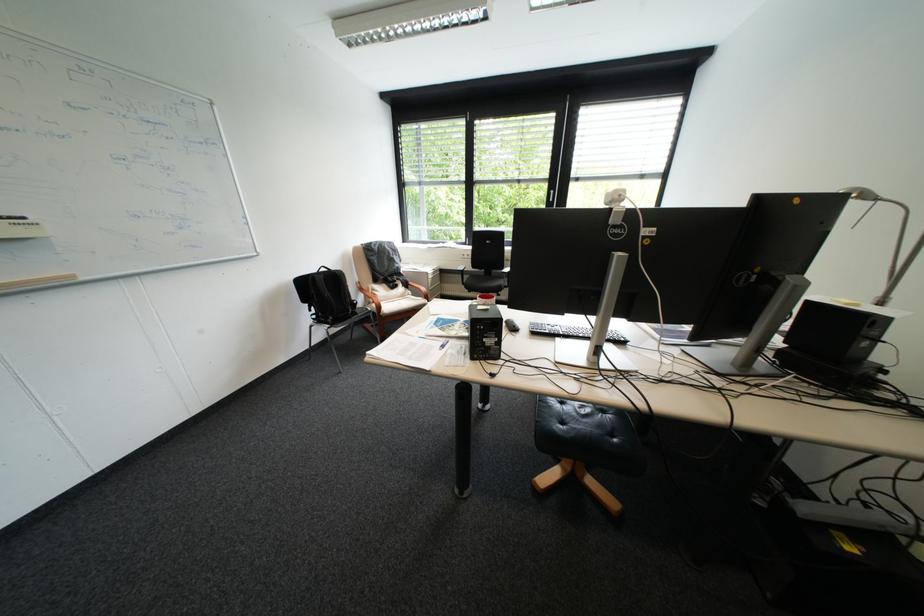
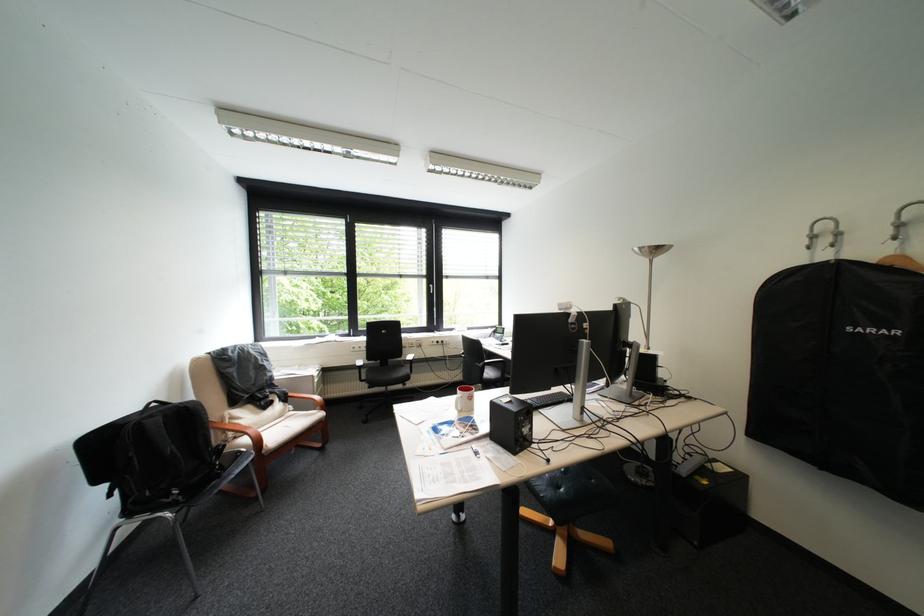
Where in the second image is the point corresponding to point (407, 270) from the first image?

(280, 381)